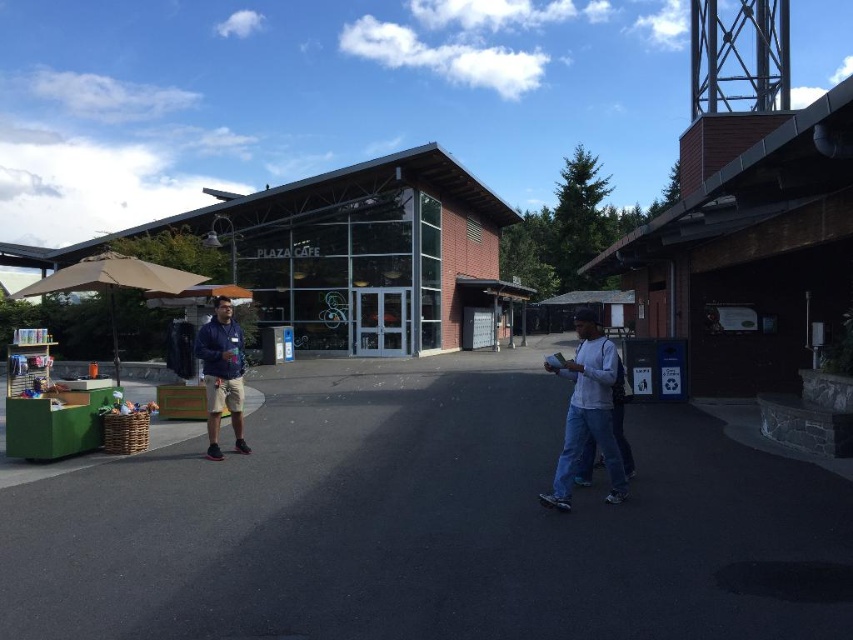
Question: Which point appears farthest from the camera in this image?

Choices:
 (A) (x=601, y=365)
 (B) (x=328, y=230)

Answer: (B)

Question: Is navy blue jacket at center below tan fabric umbrella at left?

Choices:
 (A) no
 (B) yes

Answer: (B)

Question: Can you confirm if brick building at center is positioned above white matte shirt at center?

Choices:
 (A) yes
 (B) no

Answer: (A)

Question: Which object is positioned closest to the brick building at center?

Choices:
 (A) tan fabric umbrella at left
 (B) white matte shirt at center
 (C) navy blue jacket at center

Answer: (A)

Question: Based on their relative distances, which object is farther from the tan fabric umbrella at left?

Choices:
 (A) white matte shirt at center
 (B) brick building at center

Answer: (A)

Question: Does white matte shirt at center lie in front of navy blue jacket at center?

Choices:
 (A) no
 (B) yes

Answer: (B)